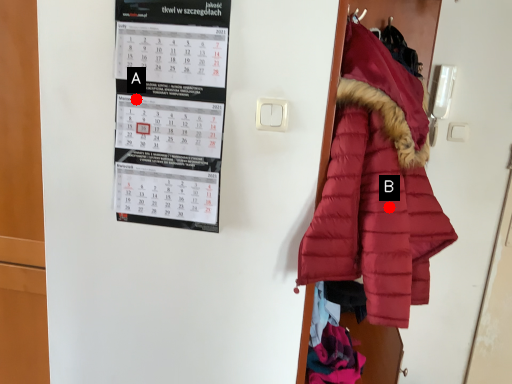
Question: Two points are circled on the image, labeled by A and B beside each circle. Which point is farther to the camera?

Choices:
 (A) A is further
 (B) B is further

Answer: (A)